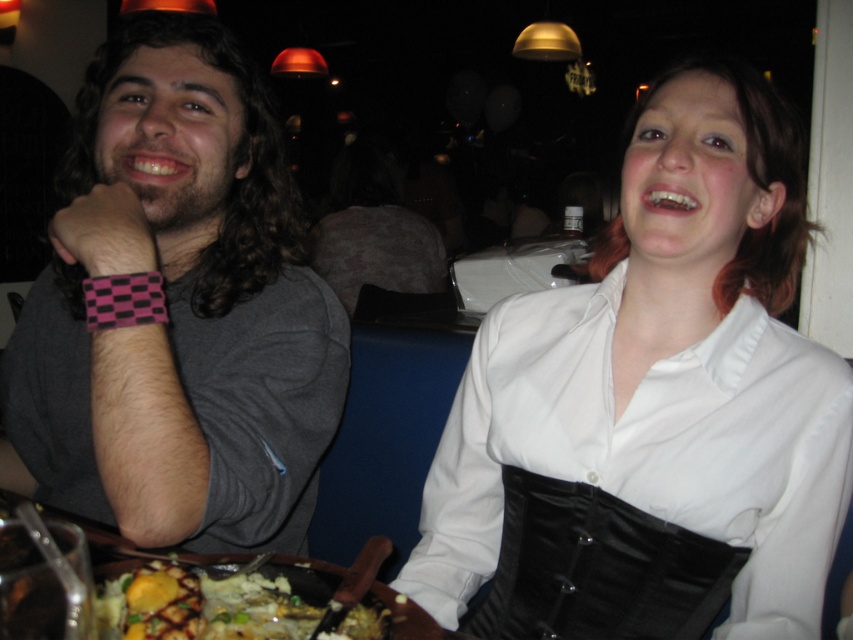
You are a photographer standing in front of the wooden table at lower center and want to take a photo of the white matte shirt at upper right without the table blocking the view. Is this possible based on their positions?

Yes, the white matte shirt at upper right is further to the viewer than the wooden table at lower center, so the table won not block the view when taking the photo.

You are a waiter in a restaurant. You need to place a new dish on the table between the white matte shirt at upper right and the golden mashed potatoes at lower center. Where should you place it to ensure it is between them?

Place the new dish between the white matte shirt at upper right and the golden mashed potatoes at lower center. Since the white matte shirt at upper right is above the golden mashed potatoes at lower center, the dish should be placed below the white matte shirt at upper right and above the golden mashed potatoes at lower center to be between them.

You are a fashion designer observing the scene in the image. You need to determine which object, the white matte shirt at upper right or the wooden table at lower center, would require more fabric to create. Based on the description provided, which one would you choose?

The white matte shirt at upper right has a larger size compared to the wooden table at lower center, so it would require more fabric to create.